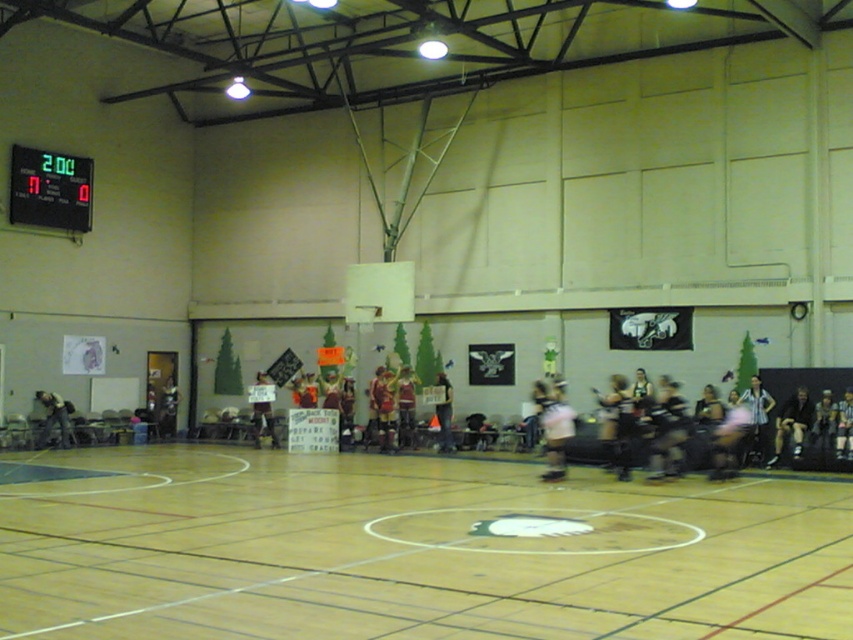
Is pink fabric at center positioned behind black leather jacket at lower right?

No, it is not.

Is pink fabric at center to the right of black leather jacket at lower right from the viewer's perspective?

In fact, pink fabric at center is to the left of black leather jacket at lower right.

The width and height of the screenshot is (853, 640). In order to click on pink fabric at center in this screenshot , I will do `click(553, 426)`.

Can you confirm if wooden floor at center is shorter than pink fabric at center?

Incorrect, wooden floor at center's height does not fall short of pink fabric at center's.

Is wooden floor at center further to camera compared to pink fabric at center?

No, it is in front of pink fabric at center.

Is point (476, 531) more distant than point (544, 445)?

No, it is in front of (544, 445).

Find the location of a particular element. This screenshot has height=640, width=853. wooden floor at center is located at coordinates (410, 552).

Can you confirm if matte black jacket at center is positioned below white jersey at center?

No, matte black jacket at center is not below white jersey at center.

Can you confirm if matte black jacket at center is shorter than white jersey at center?

No.

The height and width of the screenshot is (640, 853). Identify the location of matte black jacket at center. (166, 406).